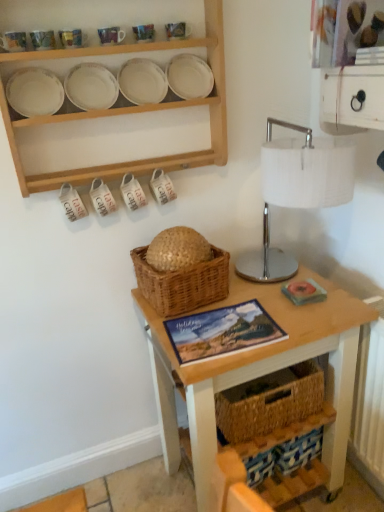
Locate an element on the screen. The height and width of the screenshot is (512, 384). vacant area located to the right-hand side of matte paper book at center is located at coordinates (295, 314).